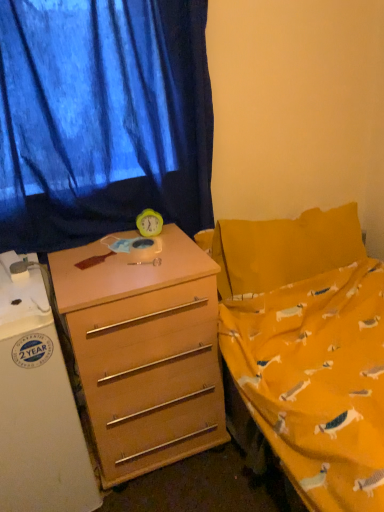
Identify the location of empty space that is ontop of light brown wood desk at center. This screenshot has width=384, height=512. (121, 258).